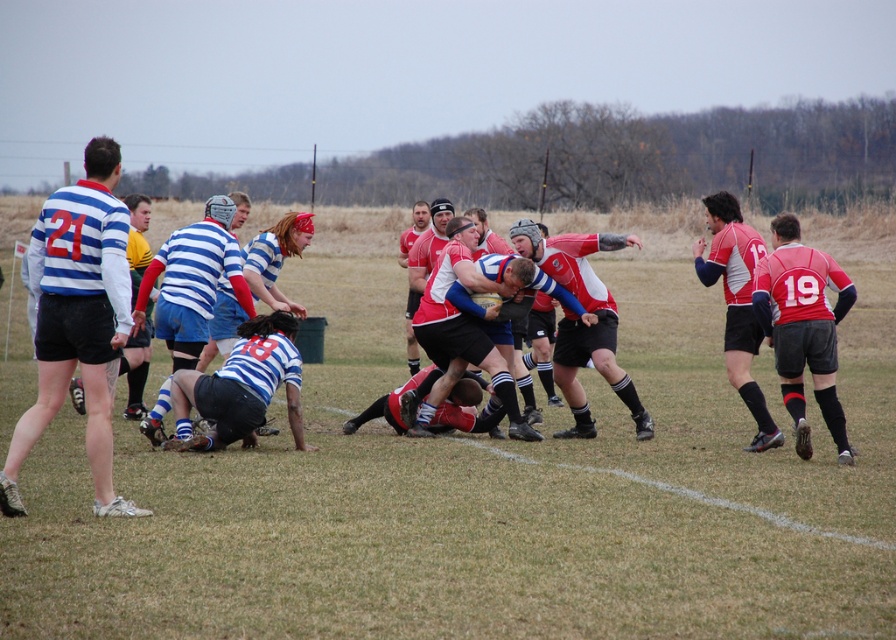
Consider the image. You are a referee observing the rugby scrum. You notice two players wearing striped jersey shorts at left and matte red rugby jersey at right. Which player is positioned more to the left side of the scrum?

The striped jersey shorts at left is positioned more to the left side of the scrum than the matte red rugby jersey at right.

Consider the image. You are a sports analyst observing the rugby match. You notice two players wearing striped jersey shorts at left and matte red rugby jersey at right. Which player has a wider uniform? Please base your answer on the visual details provided in the scene.

The striped jersey shorts at left have a larger width than the matte red rugby jersey at right, so the player wearing the striped jersey shorts at left has a wider uniform.